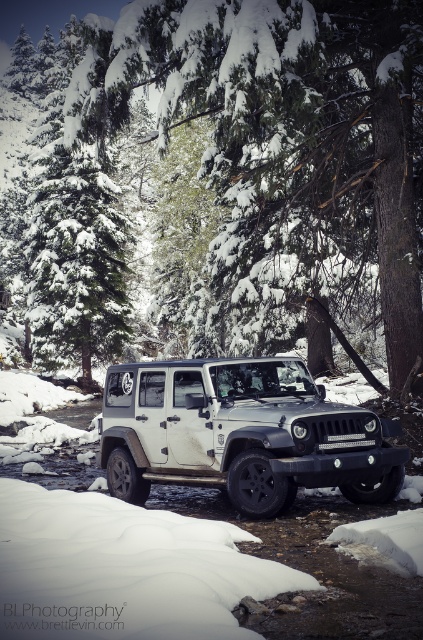
Question: Is green textured pine tree at upper center wider than white matte/soft jeep at center?

Choices:
 (A) no
 (B) yes

Answer: (B)

Question: Among these points, which one is nearest to the camera?

Choices:
 (A) pos(206,433)
 (B) pos(411,266)

Answer: (A)

Question: Is green textured pine tree at upper center behind snow-covered evergreen tree at upper left?

Choices:
 (A) no
 (B) yes

Answer: (A)

Question: Is green textured pine tree at upper center to the right of snow-covered evergreen tree at upper left from the viewer's perspective?

Choices:
 (A) yes
 (B) no

Answer: (A)

Question: Which of these objects is positioned farthest from the white matte/soft jeep at center?

Choices:
 (A) snow-covered evergreen tree at upper left
 (B) green textured pine tree at upper center

Answer: (A)

Question: Considering the real-world distances, which object is closest to the white matte/soft jeep at center?

Choices:
 (A) snow-covered evergreen tree at upper left
 (B) green textured pine tree at upper center

Answer: (B)